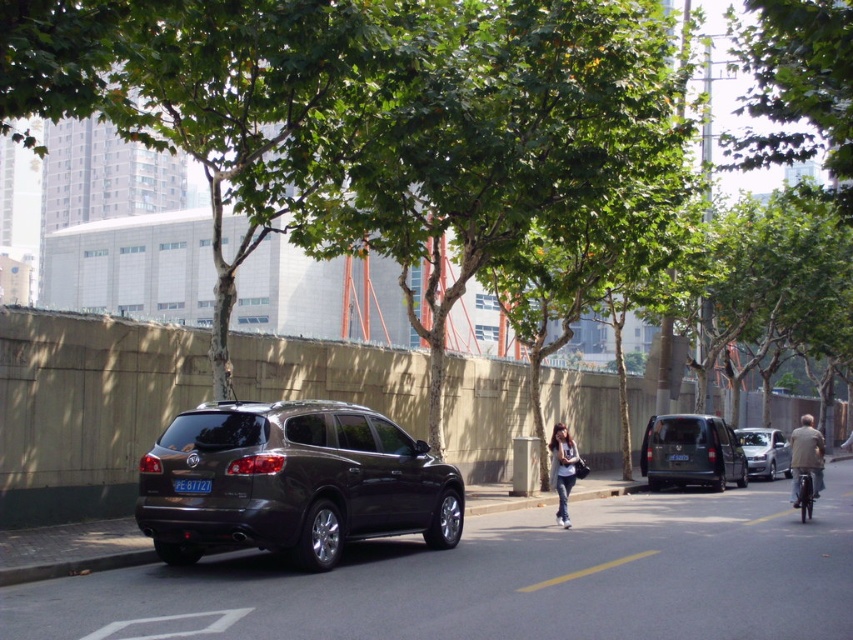
In the scene shown: You are a delivery person who needs to load a tall package into one of the vehicles. Based on the scene, which vehicle between the dark gray matte minivan at center and the matte gray van at right would allow for taller items due to its height?

The dark gray matte minivan at center has a greater height compared to the matte gray van at right, so it would be the better choice for loading taller items.

You are a pedestrian standing on the sidewalk looking at the dark SUV parked on the street. You notice the denim jeans at center and the black plastic license plate at center. Which object is closer to your right side?

The denim jeans at center is to the right of the black plastic license plate at center, so the denim jeans at center is closer to your right side.

You are a delivery person who needs to place a package on the brown leather jacket at right. The satin dark gray minivan at center is blocking your path. Can you go around the minivan to reach the jacket?

The satin dark gray minivan at center is positioned over brown leather jacket at right, meaning the minivan is directly blocking the jacket. You cannot go around the minivan to reach the jacket because it is covering it completely.